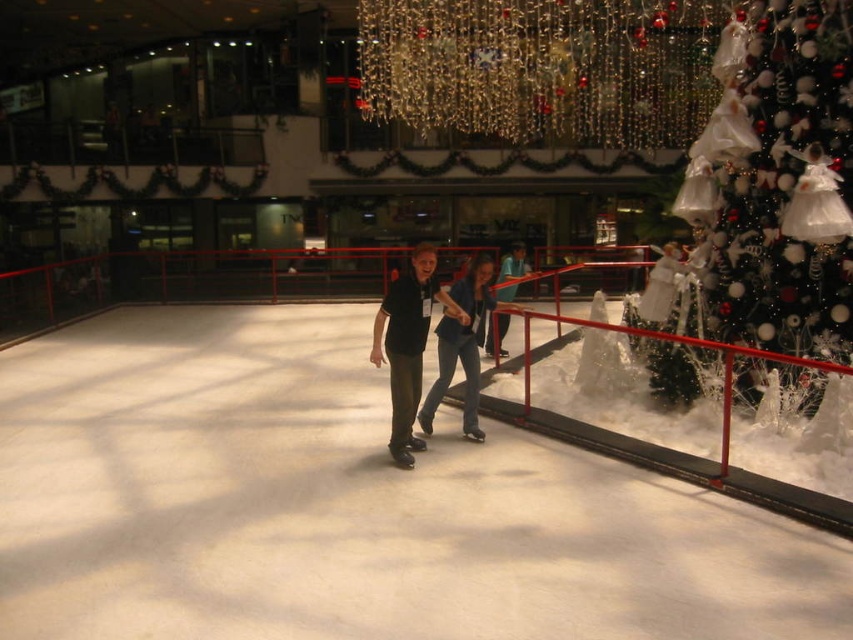
Find the location of `white smooth ice at center`. white smooth ice at center is located at coordinates (347, 506).

Is white smooth ice at center bigger than matte black skates at center?

A: Yes, white smooth ice at center is bigger than matte black skates at center.

Is point (463, 525) in front of point (427, 310)?

That is True.

Locate an element on the screen. white smooth ice at center is located at coordinates (347, 506).

From the picture: Which of these two, shiny green tree at right or matte black skates at center, stands taller?

shiny green tree at right

Between point (737, 333) and point (421, 296), which one is positioned behind?

Point (737, 333)

What are the coordinates of `shiny green tree at right` in the screenshot? It's located at (776, 195).